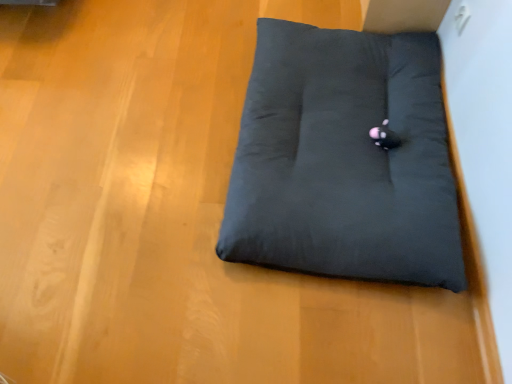
The height and width of the screenshot is (384, 512). Identify the location of vacant space to the left of matte black pillow at center. (126, 140).